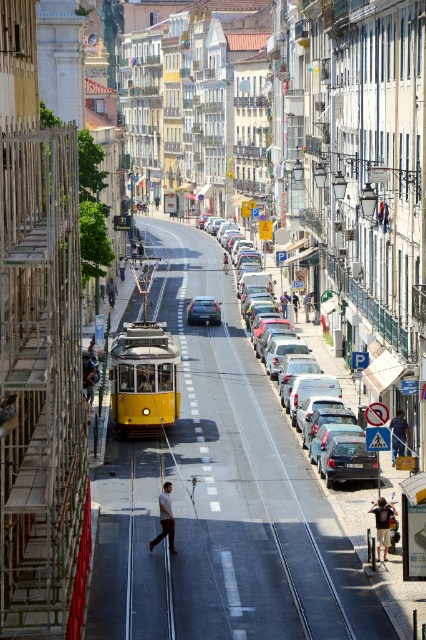
Question: Is dark blue jeans at lower right behind light brown leather jacket at center?

Choices:
 (A) no
 (B) yes

Answer: (A)

Question: Which point is farther to the camera?

Choices:
 (A) (397, 442)
 (B) (109, 289)

Answer: (B)

Question: Is metallic silver sedan at center to the left of denim jacket at center from the viewer's perspective?

Choices:
 (A) yes
 (B) no

Answer: (A)

Question: Which of the following is the farthest from the observer?

Choices:
 (A) (164, 484)
 (B) (383, 532)

Answer: (A)

Question: Is silver metallic sedan at center thinner than blue fabric bag at center?

Choices:
 (A) yes
 (B) no

Answer: (B)

Question: Among these points, which one is farthest from the camera?

Choices:
 (A) (284, 292)
 (B) (173, 536)

Answer: (A)